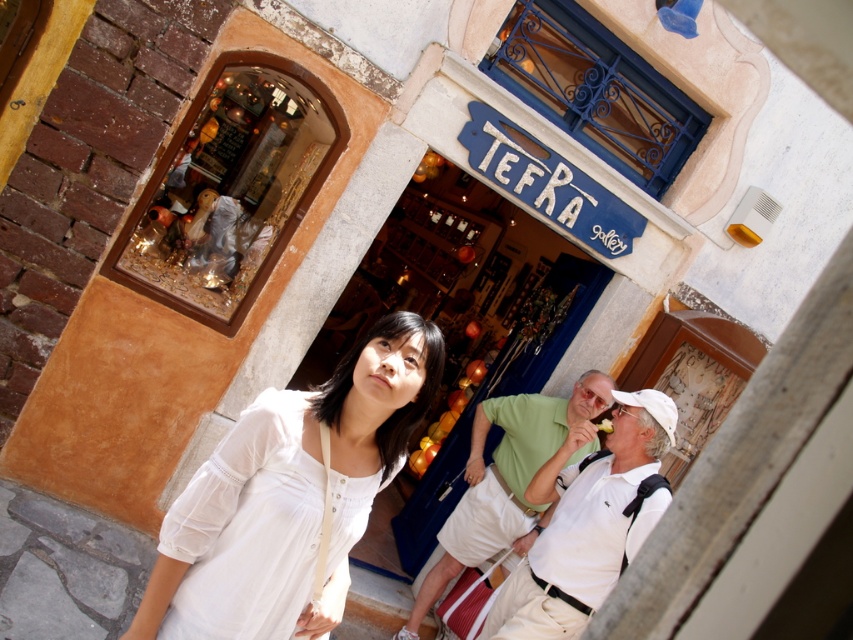
Question: Which of the following is the closest to the observer?

Choices:
 (A) white cotton shirt at center
 (B) white cotton blouse at center

Answer: (B)

Question: Considering the real-world distances, which object is closest to the white cotton blouse at center?

Choices:
 (A) white cotton shirt at center
 (B) white cotton shirt at lower right

Answer: (B)

Question: Estimate the real-world distances between objects in this image. Which object is closer to the white cotton blouse at center?

Choices:
 (A) white cotton shirt at center
 (B) white cotton shirt at lower right

Answer: (B)

Question: Is white cotton blouse at center thinner than white cotton shirt at center?

Choices:
 (A) yes
 (B) no

Answer: (A)

Question: Considering the relative positions of white cotton blouse at center and white cotton shirt at center in the image provided, where is white cotton blouse at center located with respect to white cotton shirt at center?

Choices:
 (A) right
 (B) left

Answer: (B)

Question: Is white cotton blouse at center to the left of white cotton shirt at lower right from the viewer's perspective?

Choices:
 (A) no
 (B) yes

Answer: (B)